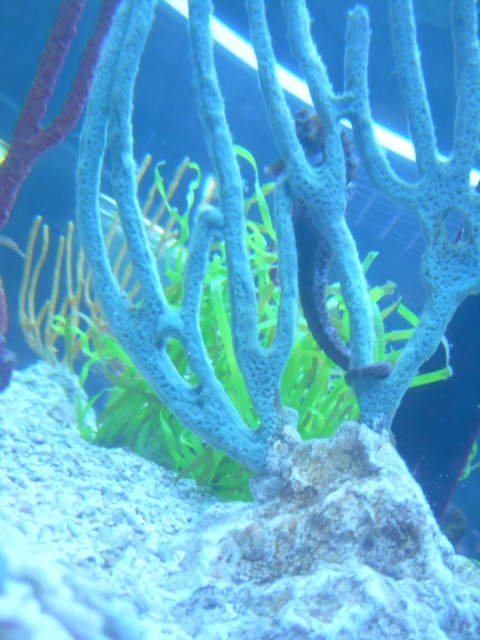
You are an underwater photographer aiming to capture both the shiny silver fish at center and the translucent blue fish at upper left in the same frame. Based on their positions, which fish is located closer to the camera?

The translucent blue fish at upper left is closer to the camera because the shiny silver fish at center is positioned under it.

You are an underwater photographer aiming to capture both the shiny silver fish at center and the translucent blue fish at upper left in a single frame. Which fish should you adjust your camera to focus on first to ensure both are in the shot?

You should focus on the shiny silver fish at center first because it is positioned on the right side of the translucent blue fish at upper left, meaning it is closer to the right edge of the frame. By centering the camera on the shiny silver fish at center, you can then adjust to include the translucent blue fish at upper left without losing the primary subject.